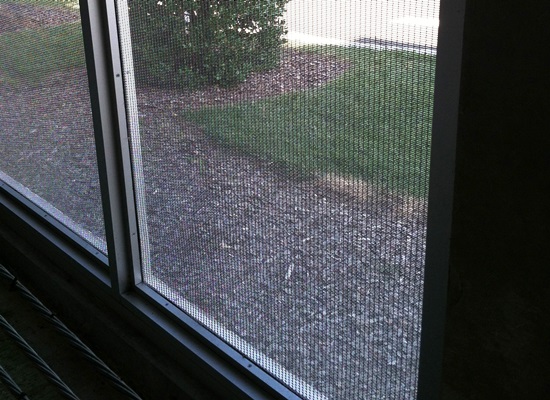
The image size is (550, 400). I want to click on 2 window screens, so click(337, 276), click(49, 123).